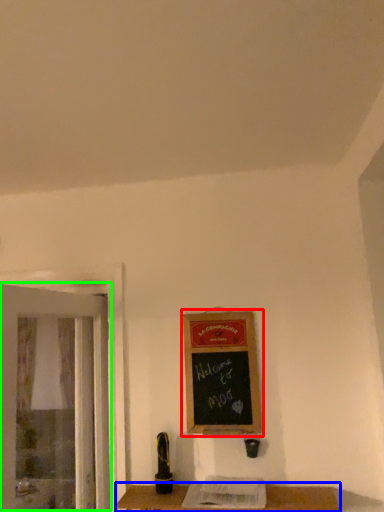
Question: Which object is the farthest from bulletin board (highlighted by a red box)? Choose among these: table (highlighted by a blue box) or screen door (highlighted by a green box).

Choices:
 (A) table
 (B) screen door

Answer: (B)